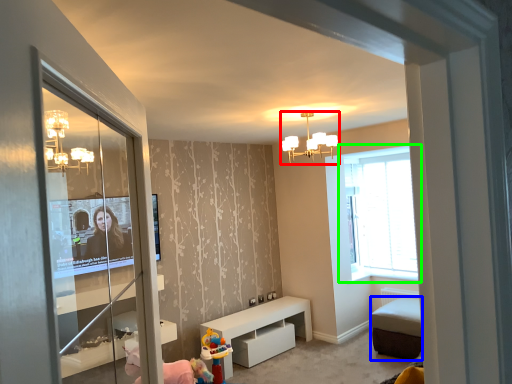
Question: Which object is the closest to the light fixture (highlighted by a red box)? Choose among these: furniture (highlighted by a blue box) or window (highlighted by a green box).

Choices:
 (A) furniture
 (B) window

Answer: (B)